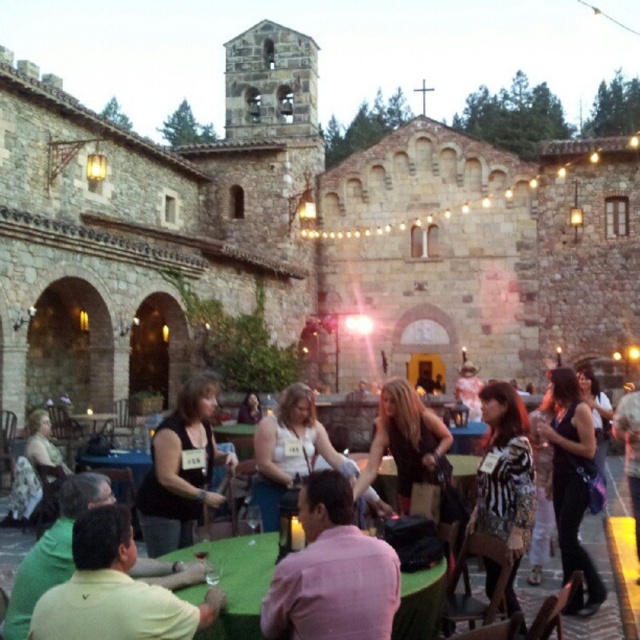
Does point (422, 576) lie in front of point (426, 604)?

No, (422, 576) is behind (426, 604).

Who is higher up, matte black dress at center or green fabric table at center?

matte black dress at center is higher up.

Locate an element on the screen. The height and width of the screenshot is (640, 640). matte black dress at center is located at coordinates (243, 582).

Is matte black dress at center behind black sleeveless top at center?

That is False.

Is matte black dress at center to the right of black sleeveless top at center from the viewer's perspective?

Indeed, matte black dress at center is positioned on the right side of black sleeveless top at center.

Identify the location of matte black dress at center. The width and height of the screenshot is (640, 640). (243, 582).

Who is higher up, zebra-patterned dress at center or black satin dress at center?

zebra-patterned dress at center is above.

Describe the element at coordinates (504, 476) in the screenshot. The height and width of the screenshot is (640, 640). I see `zebra-patterned dress at center` at that location.

Between point (500, 438) and point (392, 426), which one is positioned behind?

Positioned behind is point (392, 426).

In order to click on zebra-patterned dress at center in this screenshot , I will do `click(504, 476)`.